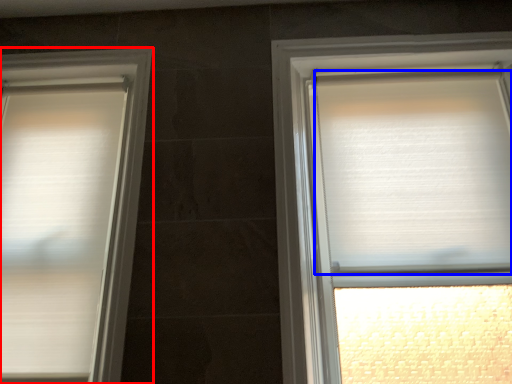
Question: Which of the following is the closest to the observer, window (highlighted by a red box) or blind (highlighted by a blue box)?

Choices:
 (A) window
 (B) blind

Answer: (A)